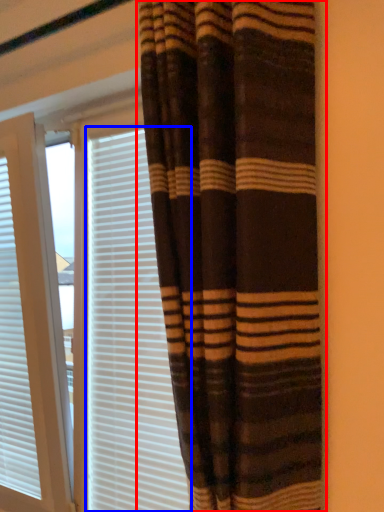
Question: Which of the following is the farthest to the observer, curtain (highlighted by a red box) or blind (highlighted by a blue box)?

Choices:
 (A) curtain
 (B) blind

Answer: (B)